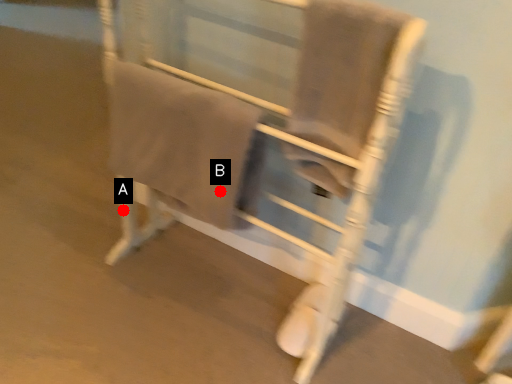
Question: Two points are circled on the image, labeled by A and B beside each circle. Which point is closer to the camera taking this photo?

Choices:
 (A) A is closer
 (B) B is closer

Answer: (B)